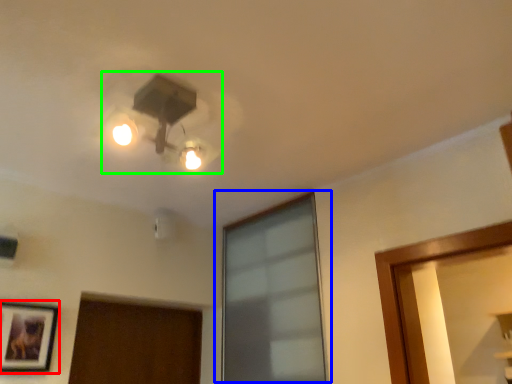
Question: Which is nearer to the picture frame (highlighted by a red box)? window (highlighted by a blue box) or lamp (highlighted by a green box).

Choices:
 (A) window
 (B) lamp

Answer: (B)